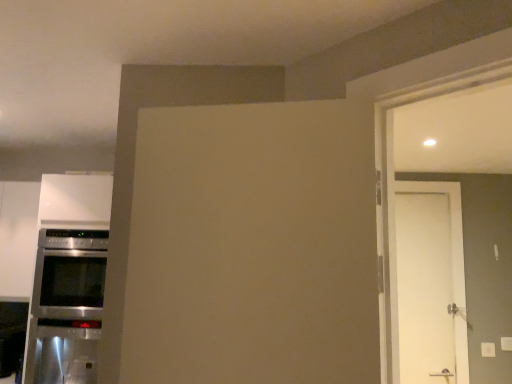
Question: Does point (404, 304) appear closer or farther from the camera than point (33, 324)?

Choices:
 (A) closer
 (B) farther

Answer: (B)

Question: Relative to stainless steel oven at left, is white matte door at right in front or behind?

Choices:
 (A) behind
 (B) front

Answer: (A)

Question: Based on their positions, is white matte door at right located to the left or right of stainless steel oven at left?

Choices:
 (A) left
 (B) right

Answer: (B)

Question: Looking at their shapes, would you say stainless steel oven at left is wider or thinner than white matte door at right?

Choices:
 (A) thin
 (B) wide

Answer: (B)

Question: Is stainless steel oven at left in front of or behind white matte door at right in the image?

Choices:
 (A) behind
 (B) front

Answer: (B)

Question: In terms of size, does stainless steel oven at left appear bigger or smaller than white matte door at right?

Choices:
 (A) small
 (B) big

Answer: (B)

Question: In terms of height, does stainless steel oven at left look taller or shorter compared to white matte door at right?

Choices:
 (A) short
 (B) tall

Answer: (A)